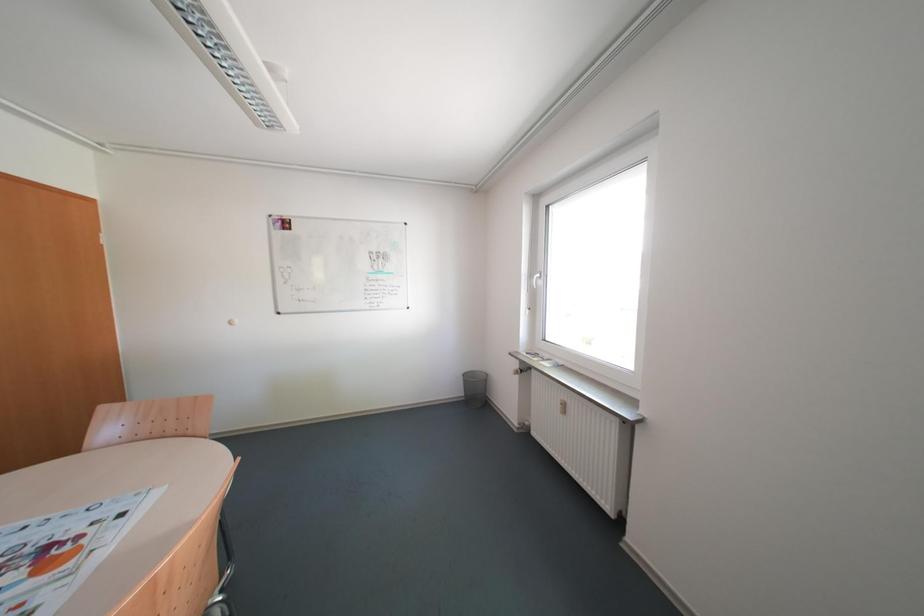
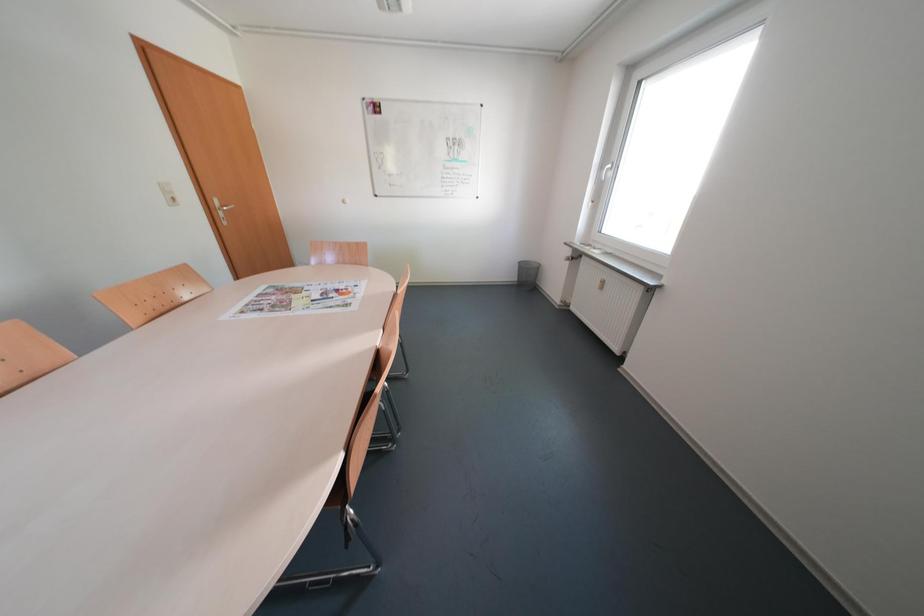
Question: In a continuous first-person perspective shot, in which direction is the camera moving?

Choices:
 (A) Left
 (B) Right
 (C) Forward
 (D) Backward

Answer: (D)